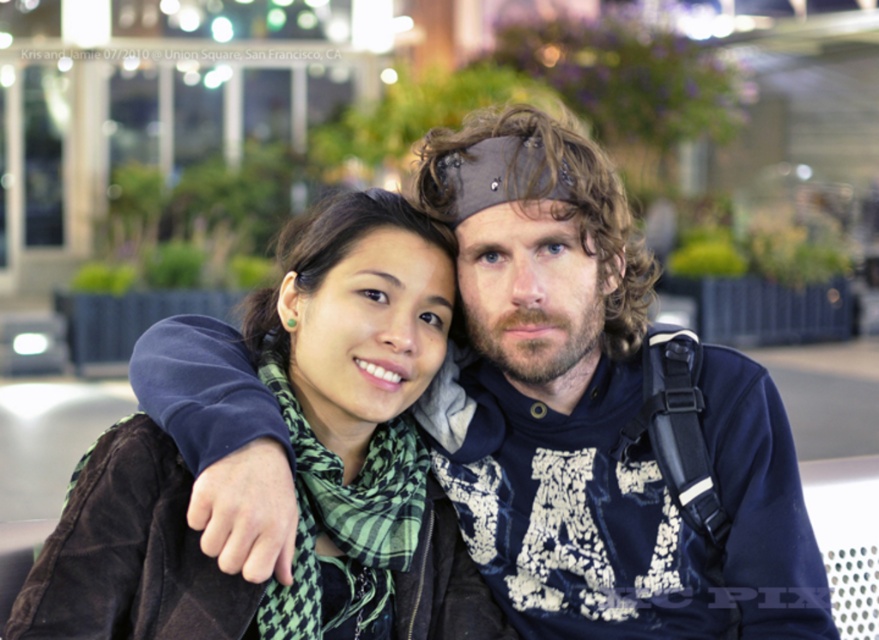
Is velvet blue sweatshirt at center above green plaid scarf at center?

Yes, velvet blue sweatshirt at center is above green plaid scarf at center.

Who is more distant from viewer, (578, 557) or (97, 557)?

Point (578, 557)

What do you see at coordinates (594, 412) in the screenshot? The width and height of the screenshot is (879, 640). I see `velvet blue sweatshirt at center` at bounding box center [594, 412].

Where is `velvet blue sweatshirt at center`? velvet blue sweatshirt at center is located at coordinates (594, 412).